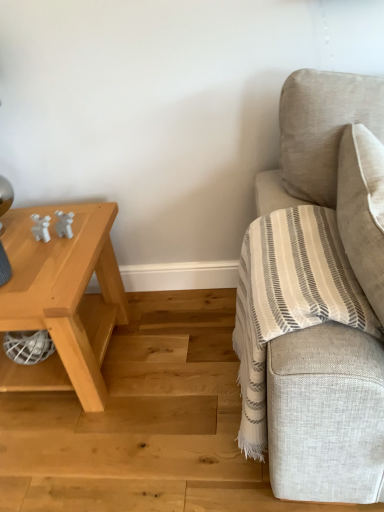
Question: Is natural wood stair at lower right next to light wood table at left?

Choices:
 (A) no
 (B) yes

Answer: (A)

Question: Is natural wood stair at lower right taller than light wood table at left?

Choices:
 (A) no
 (B) yes

Answer: (A)

Question: Is natural wood stair at lower right aimed at light wood table at left?

Choices:
 (A) yes
 (B) no

Answer: (B)

Question: Can you confirm if natural wood stair at lower right is thinner than light wood table at left?

Choices:
 (A) no
 (B) yes

Answer: (A)

Question: Does natural wood stair at lower right have a lesser height compared to light wood table at left?

Choices:
 (A) no
 (B) yes

Answer: (B)

Question: Can you confirm if natural wood stair at lower right is smaller than light wood table at left?

Choices:
 (A) no
 (B) yes

Answer: (B)

Question: From a real-world perspective, is natural wood stair at lower right beneath beige fabric couch at right?

Choices:
 (A) no
 (B) yes

Answer: (B)

Question: Are natural wood stair at lower right and beige fabric couch at right making contact?

Choices:
 (A) no
 (B) yes

Answer: (A)

Question: Does natural wood stair at lower right come behind beige fabric couch at right?

Choices:
 (A) no
 (B) yes

Answer: (B)

Question: Does natural wood stair at lower right have a smaller size compared to beige fabric couch at right?

Choices:
 (A) no
 (B) yes

Answer: (B)

Question: Does natural wood stair at lower right come in front of beige fabric couch at right?

Choices:
 (A) yes
 (B) no

Answer: (B)

Question: Is natural wood stair at lower right taller than beige fabric couch at right?

Choices:
 (A) no
 (B) yes

Answer: (A)

Question: From the image's perspective, would you say light wood table at left is positioned over natural wood stair at lower right?

Choices:
 (A) no
 (B) yes

Answer: (B)